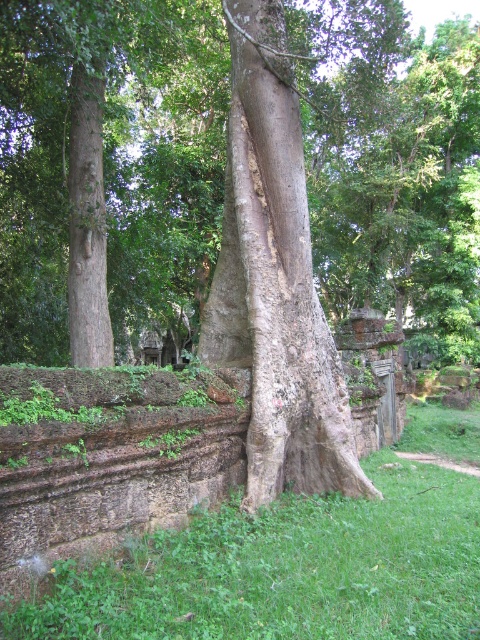
Can you confirm if smooth gray tree trunk at center is positioned below gray rough tree trunk at center?

No.

Is point (46, 92) in front of point (264, 83)?

No, it is not.

Does point (119, 129) lie in front of point (253, 1)?

No, (119, 129) is further to viewer.

I want to click on smooth gray tree trunk at center, so click(108, 172).

Can you confirm if green grass at lower center is positioned to the left of smooth brown tree trunk at left?

Incorrect, green grass at lower center is not on the left side of smooth brown tree trunk at left.

Is green grass at lower center thinner than smooth brown tree trunk at left?

In fact, green grass at lower center might be wider than smooth brown tree trunk at left.

You are a GUI agent. You are given a task and a screenshot of the screen. Output one action in this format:
    pyautogui.click(x=<x>, y=<y>)
    Task: Click on the green grass at lower center
    
    Given the screenshot: What is the action you would take?
    pyautogui.click(x=286, y=570)

Is smooth gray tree trunk at center to the right of smooth brown tree trunk at left from the viewer's perspective?

Correct, you'll find smooth gray tree trunk at center to the right of smooth brown tree trunk at left.

Is smooth gray tree trunk at center bigger than smooth brown tree trunk at left?

Correct, smooth gray tree trunk at center is larger in size than smooth brown tree trunk at left.

Consider the image. Who is more forward, (376, 148) or (87, 166)?

Point (87, 166) is more forward.

Locate an element on the screen. Image resolution: width=480 pixels, height=640 pixels. smooth gray tree trunk at center is located at coordinates (108, 172).